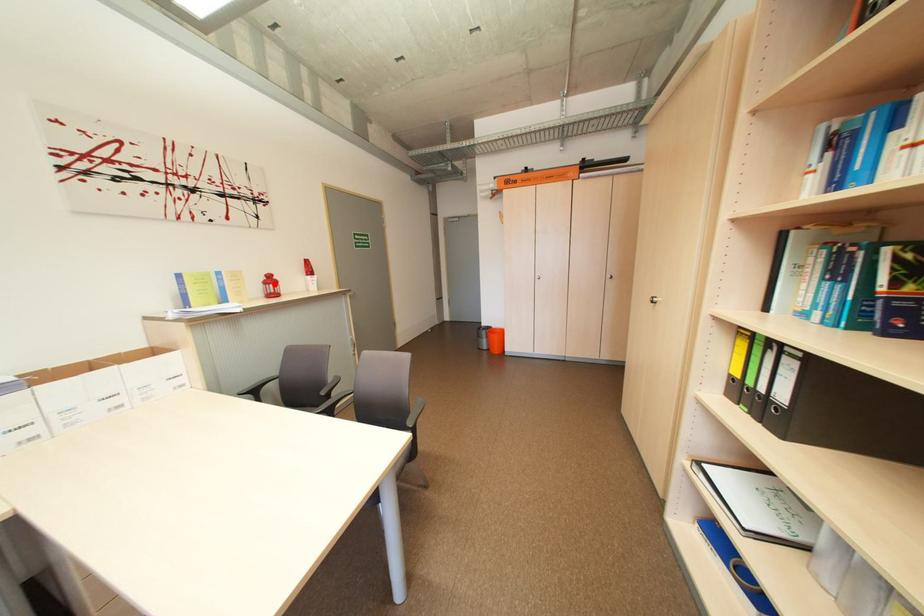
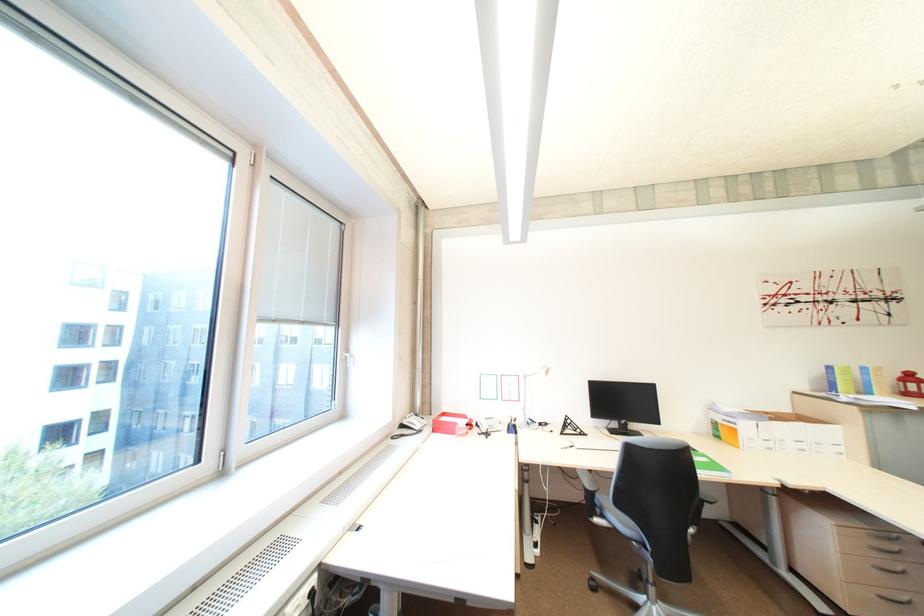
Question: I am providing you with two images of the same scene from different viewpoints. Image1 has a red point marked. In image2, the corresponding 3D location appears at what relative position? Reply with the corresponding letter.

Choices:
 (A) Closer
 (B) Farther

Answer: (A)